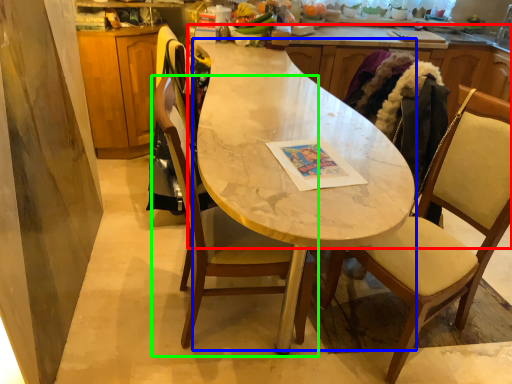
Question: Which object is the farthest from countertop (highlighted by a red box)? Choose among these: round table (highlighted by a blue box) or chair (highlighted by a green box).

Choices:
 (A) round table
 (B) chair

Answer: (B)